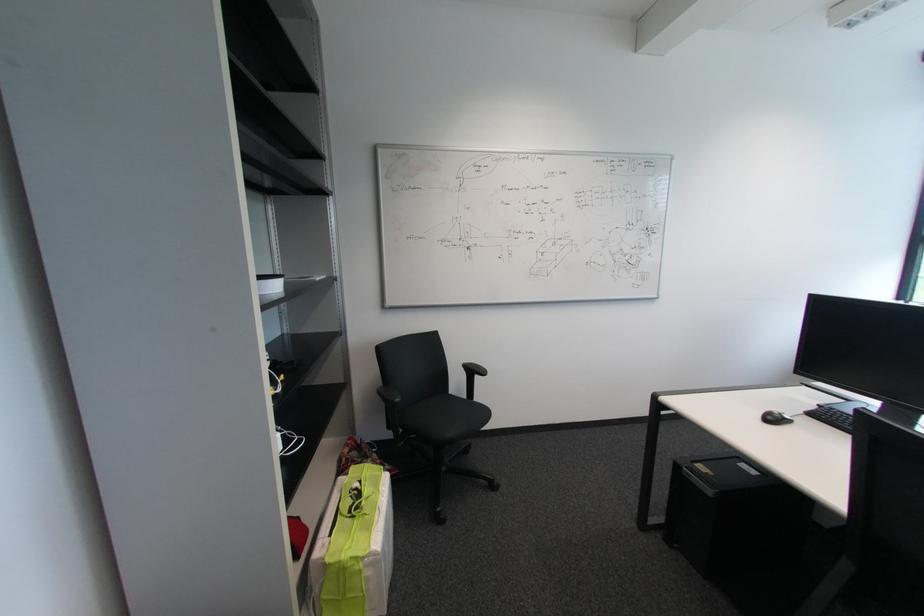
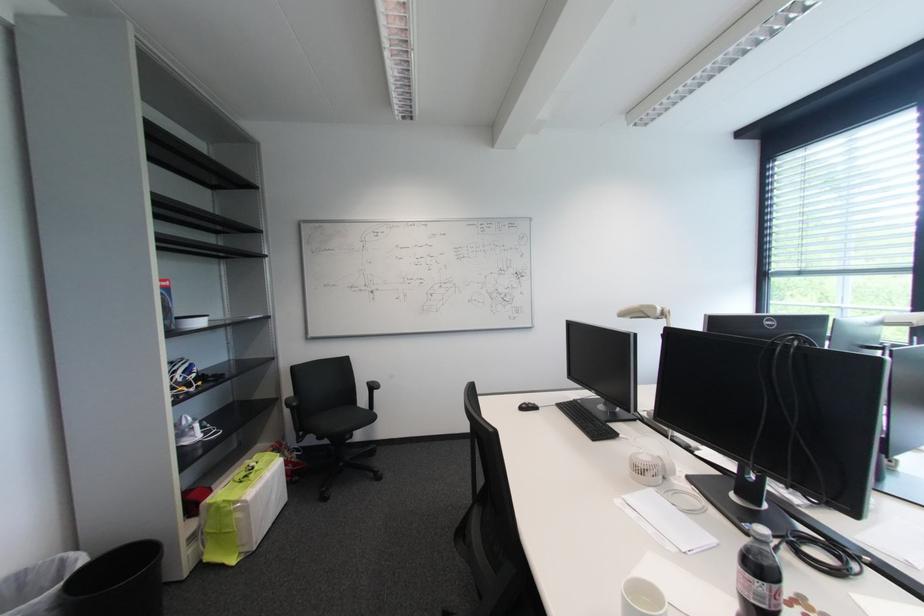
Find the pixel in the second image that matches point 358,560 in the first image.

(231, 503)